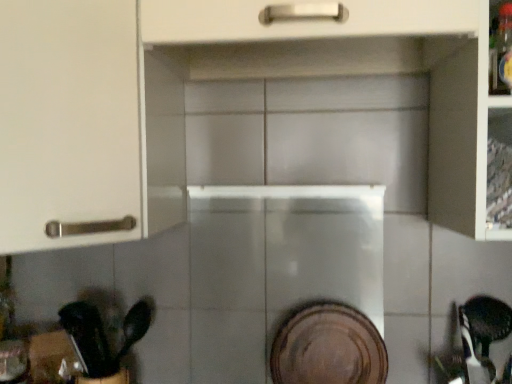
At what (x,y) coordinates should I click in order to perform the action: click on black plastic spoon at lower left. Please return your answer as a coordinate pair (x, y). The height and width of the screenshot is (384, 512). Looking at the image, I should click on (102, 339).

Considering the sizes of objects white matte cabinet at upper left and brown matte platter at center in the image provided, who is taller, white matte cabinet at upper left or brown matte platter at center?

Standing taller between the two is white matte cabinet at upper left.

Does white matte cabinet at upper left have a smaller size compared to brown matte platter at center?

No, white matte cabinet at upper left is not smaller than brown matte platter at center.

Which is behind, white matte cabinet at upper left or brown matte platter at center?

Positioned behind is brown matte platter at center.

Is black plastic spoon at lower left at the back of brown matte platter at center?

brown matte platter at center is not turned away from black plastic spoon at lower left.

Is there a large distance between brown matte platter at center and black plastic spoon at lower left?

Actually, brown matte platter at center and black plastic spoon at lower left are a little close together.

Is brown matte platter at center at the left side of black plastic spoon at lower left?

No.

Does point (386, 364) lie behind point (106, 372)?

Yes, point (386, 364) is behind point (106, 372).

From a real-world perspective, does brown matte platter at center stand above white matte cabinet at upper left?

Actually, brown matte platter at center is physically below white matte cabinet at upper left in the real world.

Considering the sizes of objects brown matte platter at center and white matte cabinet at upper left in the image provided, who is bigger, brown matte platter at center or white matte cabinet at upper left?

white matte cabinet at upper left is bigger.

Would you consider brown matte platter at center to be distant from white matte cabinet at upper left?

No, brown matte platter at center is not far away from white matte cabinet at upper left.

Can brown matte platter at center be found inside black plastic spoon at lower left?

No, brown matte platter at center is not surrounded by black plastic spoon at lower left.

Between black plastic spoon at lower left and brown matte platter at center, which one has smaller width?

brown matte platter at center.

Considering the sizes of black plastic spoon at lower left and brown matte platter at center in the image, is black plastic spoon at lower left bigger or smaller than brown matte platter at center?

Considering their sizes, black plastic spoon at lower left takes up more space than brown matte platter at center.

Is black plastic spoon at lower left positioned beyond the bounds of white matte cabinet at upper left?

Yes, black plastic spoon at lower left is located beyond the bounds of white matte cabinet at upper left.

From the image's perspective, which object appears higher, black plastic spoon at lower left or white matte cabinet at upper left?

white matte cabinet at upper left appears higher in the image.

Is black plastic spoon at lower left positioned with its back to white matte cabinet at upper left?

No, white matte cabinet at upper left is not at the back of black plastic spoon at lower left.

Which object is positioned more to the left, white matte cabinet at upper left or black plastic spoon at lower left?

Positioned to the left is white matte cabinet at upper left.

Can you confirm if white matte cabinet at upper left is thinner than black plastic spoon at lower left?

In fact, white matte cabinet at upper left might be wider than black plastic spoon at lower left.

Locate an element on the screen. This screenshot has height=384, width=512. tableware below the white matte cabinet at upper left (from a real-world perspective) is located at coordinates (102, 339).

Is white matte cabinet at upper left completely or partially outside of black plastic spoon at lower left?

Indeed, white matte cabinet at upper left is completely outside black plastic spoon at lower left.

Locate an element on the screen. Image resolution: width=512 pixels, height=384 pixels. cabinetry above the brown matte platter at center (from the image's perspective) is located at coordinates (86, 127).

Find the location of a particular element. This screenshot has height=384, width=512. tableware that is in front of the brown matte platter at center is located at coordinates (102, 339).

Which object lies nearer to the anchor point black plastic spoon at lower left, brown matte platter at center or white matte cabinet at upper left?

brown matte platter at center is closer to black plastic spoon at lower left.

Based on their spatial positions, is brown matte platter at center or black plastic spoon at lower left closer to white matte cabinet at upper left?

Among the two, black plastic spoon at lower left is located nearer to white matte cabinet at upper left.

Looking at the image, which one is located further to black plastic spoon at lower left, white matte cabinet at upper left or brown matte platter at center?

white matte cabinet at upper left is positioned further to the anchor black plastic spoon at lower left.

Estimate the real-world distances between objects in this image. Which object is further from brown matte platter at center, black plastic spoon at lower left or white matte cabinet at upper left?

white matte cabinet at upper left lies further to brown matte platter at center than the other object.

From the image, which object appears to be farther from brown matte platter at center, white matte cabinet at upper left or black plastic spoon at lower left?

The object further to brown matte platter at center is white matte cabinet at upper left.

Which object lies further to the anchor point white matte cabinet at upper left, black plastic spoon at lower left or brown matte platter at center?

brown matte platter at center is further to white matte cabinet at upper left.

Image resolution: width=512 pixels, height=384 pixels. Identify the location of tableware between white matte cabinet at upper left and brown matte platter at center vertically. (102, 339).